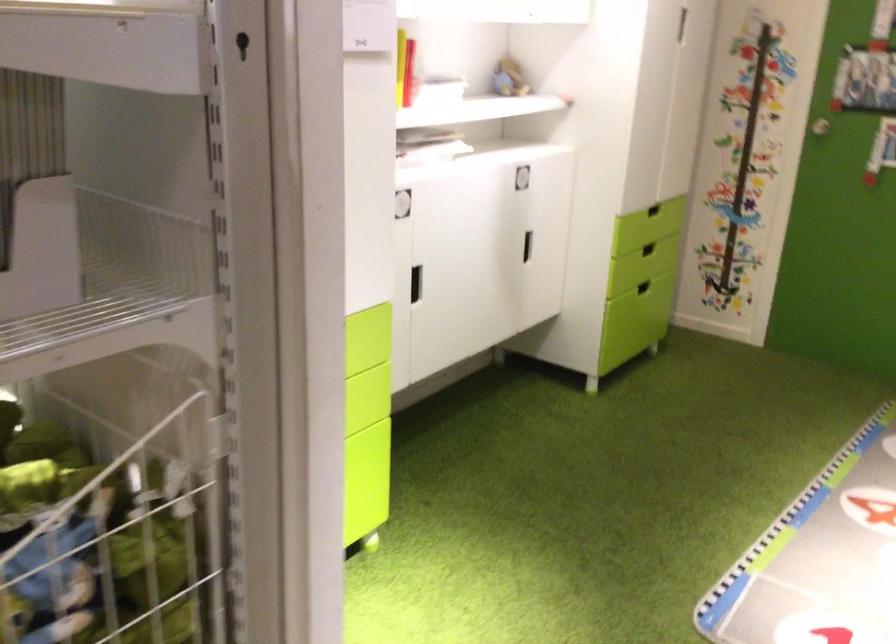
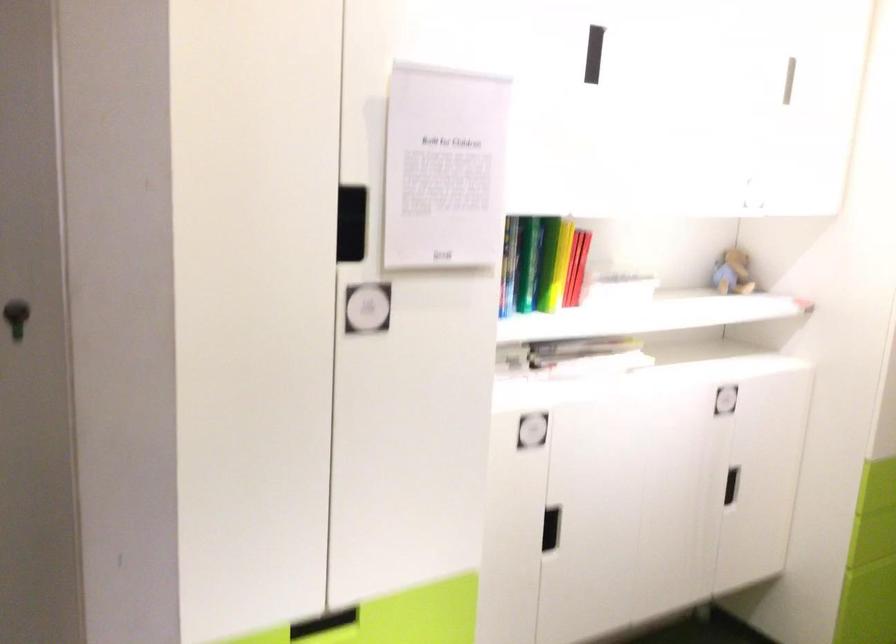
Find the pixel in the second image that matches point 403,71 in the first image.

(576, 267)